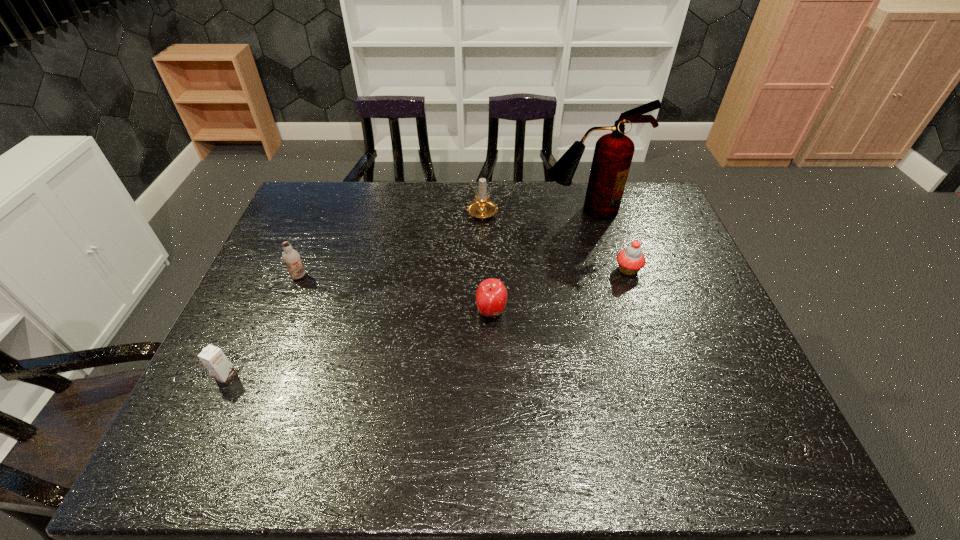
Identify the location of vacant space that satisfies the following two spatial constraints: 1. on the back side of the cupcake; 2. on the left side of the taller chocolate milk. This screenshot has height=540, width=960. (301, 270).